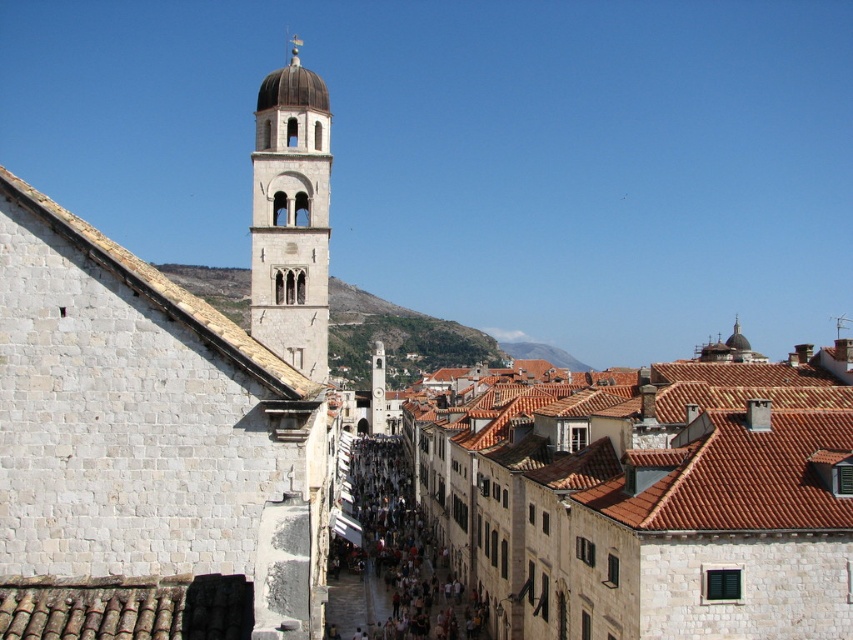
Question: Which point is farther to the camera?

Choices:
 (A) white stone tower at upper left
 (B) brown tiled roofs at center
 (C) dark brown stone crowd at center

Answer: (C)

Question: Which object is closer to the camera taking this photo?

Choices:
 (A) dark brown stone crowd at center
 (B) light beige stone bell tower at center
 (C) brown tiled roofs at center

Answer: (C)

Question: Which object is the closest to the brown tiled roofs at center?

Choices:
 (A) white stone tower at upper left
 (B) light beige stone bell tower at center

Answer: (A)

Question: Can you confirm if white stone tower at upper left is positioned to the right of dark brown stone crowd at center?

Choices:
 (A) yes
 (B) no

Answer: (B)

Question: Is white stone tower at upper left smaller than dark brown stone crowd at center?

Choices:
 (A) yes
 (B) no

Answer: (B)

Question: In this image, where is brown tiled roofs at center located relative to dark brown stone crowd at center?

Choices:
 (A) above
 (B) below

Answer: (A)